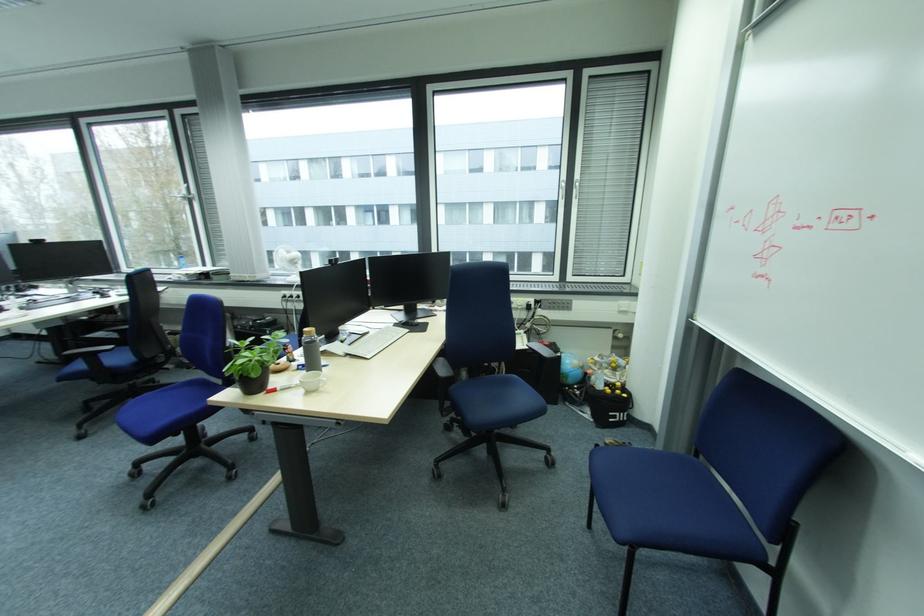
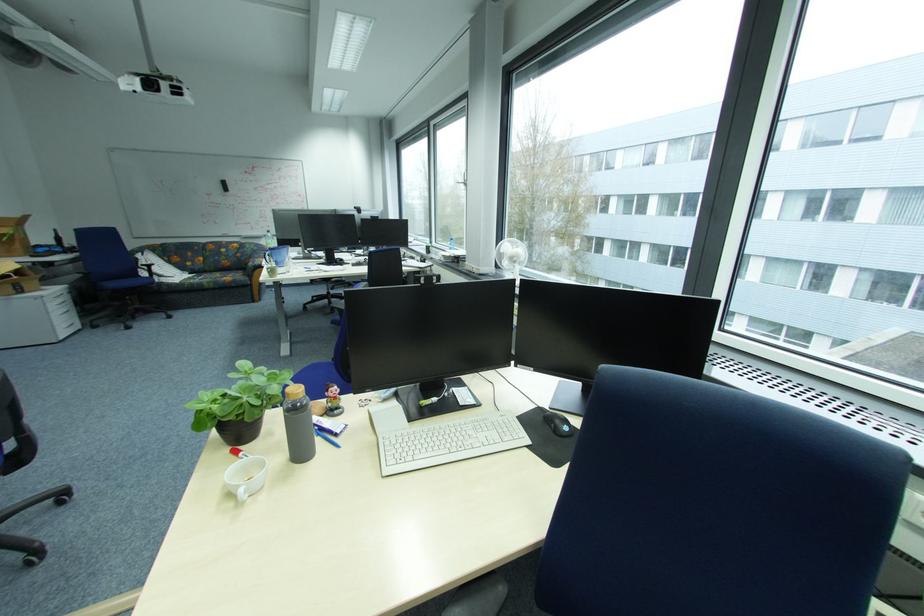
In the second image, find the point that corresponds to the point at 305,261 in the first image.

(524, 259)